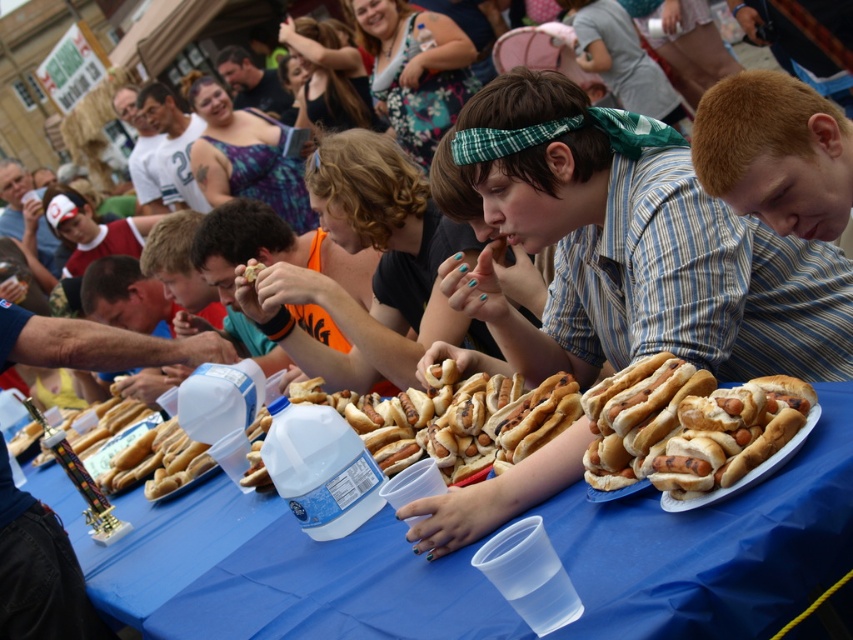
Based on the photo, you are a photographer standing at the back of the room taking pictures of the competitive eating event. You notice two points marked on the table where you want to place your camera equipment. The first point is at coordinate point [677,486] and the second is at point [170,138]. Which point is closer to you?

Point [677,486] is closer to the camera than point [170,138], so the first point is closer to you.

Where is the blue plastic table at center located in the image?

The blue plastic table at center is located at point (x=270, y=572) in the image.

Based on the photo, you are a photographer at the competitive eating event. You want to take a photo of the matte black shirt at upper center and the blue plastic table at center in the same frame. Based on their positions, which object should be placed to the left in the photo?

The matte black shirt at upper center should be placed to the left in the photo since the blue plastic table at center is positioned on the right side of it.